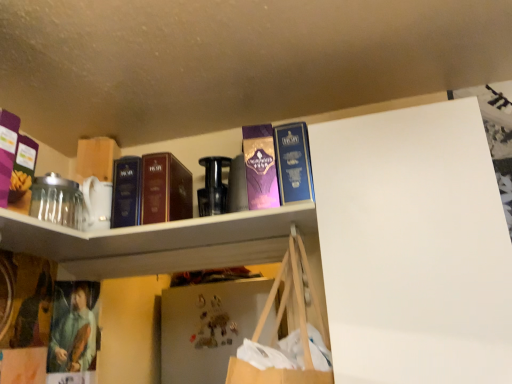
Question: From a real-world perspective, is dark blue hardcover book at center, the first book from the left, beneath matte brown book at upper center, which is the 2th book from left to right?

Choices:
 (A) yes
 (B) no

Answer: (A)

Question: From the image's perspective, is dark blue hardcover book at center, marked as the third book in a right-to-left arrangement, below matte brown book at upper center, arranged as the second book when viewed from the right?

Choices:
 (A) no
 (B) yes

Answer: (B)

Question: Is dark blue hardcover book at center, the first book from the left, not within matte brown book at upper center, arranged as the second book when viewed from the right?

Choices:
 (A) yes
 (B) no

Answer: (A)

Question: Considering the relative sizes of dark blue hardcover book at center, the first book from the left, and matte brown book at upper center, arranged as the second book when viewed from the right, in the image provided, is dark blue hardcover book at center, the first book from the left, smaller than matte brown book at upper center, arranged as the second book when viewed from the right,?

Choices:
 (A) yes
 (B) no

Answer: (B)

Question: Does dark blue hardcover book at center, the first book from the left, have a lesser width compared to matte brown book at upper center, which is the 2th book from left to right?

Choices:
 (A) no
 (B) yes

Answer: (A)

Question: Considering the relative sizes of dark blue hardcover book at center, marked as the third book in a right-to-left arrangement, and matte brown book at upper center, which is the 2th book from left to right, in the image provided, is dark blue hardcover book at center, marked as the third book in a right-to-left arrangement, shorter than matte brown book at upper center, which is the 2th book from left to right,?

Choices:
 (A) yes
 (B) no

Answer: (A)

Question: Considering the relative sizes of purple glossy paperback book at upper center and purple matte box at upper left in the image provided, is purple glossy paperback book at upper center smaller than purple matte box at upper left?

Choices:
 (A) yes
 (B) no

Answer: (B)

Question: Is purple glossy paperback book at upper center wider than purple matte box at upper left?

Choices:
 (A) yes
 (B) no

Answer: (A)

Question: From a real-world perspective, is purple glossy paperback book at upper center located higher than purple matte box at upper left?

Choices:
 (A) yes
 (B) no

Answer: (A)

Question: Is purple glossy paperback book at upper center closer to the viewer compared to purple matte box at upper left?

Choices:
 (A) no
 (B) yes

Answer: (A)

Question: From a real-world perspective, is purple glossy paperback book at upper center located beneath purple matte box at upper left?

Choices:
 (A) no
 (B) yes

Answer: (A)

Question: Considering the relative sizes of purple glossy paperback book at upper center and purple matte box at upper left in the image provided, is purple glossy paperback book at upper center thinner than purple matte box at upper left?

Choices:
 (A) yes
 (B) no

Answer: (B)

Question: Is the position of white glossy shelf at upper center less distant than that of purple glossy paperback book at upper center?

Choices:
 (A) no
 (B) yes

Answer: (B)